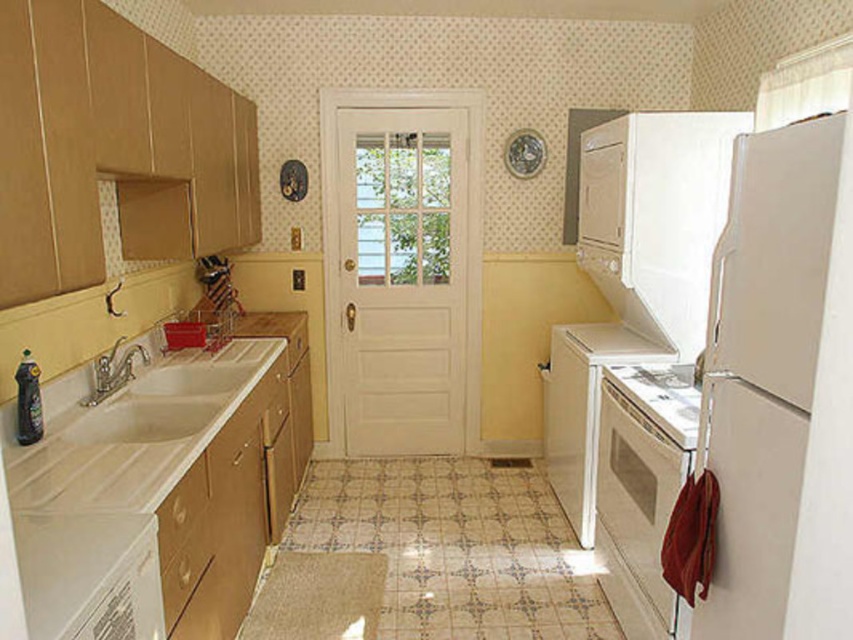
Is white matte refrigerator at right to the right of white glossy countertop at lower left from the viewer's perspective?

Correct, you'll find white matte refrigerator at right to the right of white glossy countertop at lower left.

Which is more to the left, white matte refrigerator at right or white glossy countertop at lower left?

white glossy countertop at lower left is more to the left.

Image resolution: width=853 pixels, height=640 pixels. Find the location of `white matte refrigerator at right`. white matte refrigerator at right is located at coordinates (781, 388).

Does white glossy oven at lower right have a greater height compared to white glossy stove at lower center?

Indeed, white glossy oven at lower right has a greater height compared to white glossy stove at lower center.

The image size is (853, 640). I want to click on white glossy oven at lower right, so click(x=641, y=486).

Where is `white glossy oven at lower right`? The image size is (853, 640). white glossy oven at lower right is located at coordinates (641, 486).

Which is in front, point (706, 244) or point (669, 376)?

Positioned in front is point (669, 376).

Does white glossy refrigerator at right have a greater height compared to white glossy stove at lower center?

Yes, white glossy refrigerator at right is taller than white glossy stove at lower center.

What are the coordinates of `white glossy refrigerator at right` in the screenshot? It's located at (634, 273).